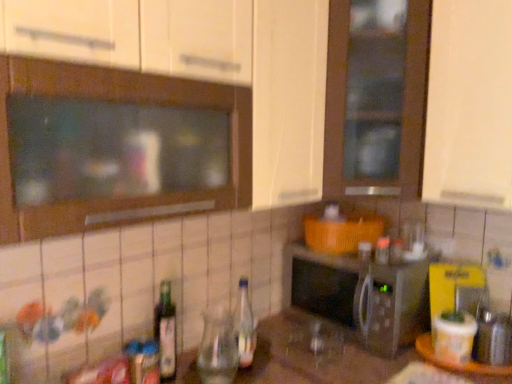
What is the approximate width of clear glass bottle at center, placed as the 1th bottle when sorted from right to left?

It is 2.91 inches.

The height and width of the screenshot is (384, 512). In order to click on green glass bottle at lower left, which is the second bottle from right to left in this screenshot , I will do `click(166, 332)`.

From the image's perspective, would you say wooden tray at lower right is shown under silver metallic microwave at center?

Correct, wooden tray at lower right appears lower than silver metallic microwave at center in the image.

Is wooden tray at lower right not near silver metallic microwave at center?

No, wooden tray at lower right is in close proximity to silver metallic microwave at center.

From a real-world perspective, is wooden tray at lower right located beneath silver metallic microwave at center?

Yes, from a real-world perspective, wooden tray at lower right is beneath silver metallic microwave at center.

How far apart are clear glass bottle at center, the 2th bottle viewed from the left, and green glass bottle at lower left, which is the second bottle from right to left?

A distance of 10.51 inches exists between clear glass bottle at center, the 2th bottle viewed from the left, and green glass bottle at lower left, which is the second bottle from right to left.

Is clear glass bottle at center, the 2th bottle viewed from the left, behind green glass bottle at lower left, arranged as the 1th bottle when viewed from the left?

Yes, clear glass bottle at center, the 2th bottle viewed from the left, is further from the viewer.

Where is `bottle that appears above the green glass bottle at lower left, arranged as the 1th bottle when viewed from the left (from a real-world perspective)`? bottle that appears above the green glass bottle at lower left, arranged as the 1th bottle when viewed from the left (from a real-world perspective) is located at coordinates (244, 326).

Could you tell me if green glass bottle at lower left, arranged as the 1th bottle when viewed from the left, is facing silver metallic microwave at center?

No, green glass bottle at lower left, arranged as the 1th bottle when viewed from the left, is not aimed at silver metallic microwave at center.

Consider the image. Could you measure the distance between green glass bottle at lower left, arranged as the 1th bottle when viewed from the left, and silver metallic microwave at center?

The distance of green glass bottle at lower left, arranged as the 1th bottle when viewed from the left, from silver metallic microwave at center is 26.71 inches.

Which object is wider, green glass bottle at lower left, arranged as the 1th bottle when viewed from the left, or silver metallic microwave at center?

silver metallic microwave at center is wider.

From a real-world perspective, is green glass bottle at lower left, which is the second bottle from right to left, on top of silver metallic microwave at center?

Yes, from a real-world perspective, green glass bottle at lower left, which is the second bottle from right to left, is over silver metallic microwave at center

Which is behind, point (415, 285) or point (425, 355)?

The point (415, 285) is more distant.

Looking at this image, can you confirm if silver metallic microwave at center is shorter than wooden tray at lower right?

No, silver metallic microwave at center is not shorter than wooden tray at lower right.

Is silver metallic microwave at center facing away from wooden tray at lower right?

silver metallic microwave at center does not have its back to wooden tray at lower right.

Is clear glass bottle at center, placed as the 1th bottle when sorted from right to left, wider than wooden tray at lower right?

No, clear glass bottle at center, placed as the 1th bottle when sorted from right to left, is not wider than wooden tray at lower right.

Can you confirm if clear glass bottle at center, the 2th bottle viewed from the left, is taller than wooden tray at lower right?

Yes, clear glass bottle at center, the 2th bottle viewed from the left, is taller than wooden tray at lower right.

From a real-world perspective, is clear glass bottle at center, the 2th bottle viewed from the left, below wooden tray at lower right?

No, from a real-world perspective, clear glass bottle at center, the 2th bottle viewed from the left, is not beneath wooden tray at lower right.

Which is behind, clear glass bottle at center, placed as the 1th bottle when sorted from right to left, or wooden tray at lower right?

wooden tray at lower right.

Which of these two, wooden tray at lower right or green glass bottle at lower left, which is the second bottle from right to left, is bigger?

Bigger between the two is wooden tray at lower right.

How distant is wooden tray at lower right from green glass bottle at lower left, which is the second bottle from right to left?

84.88 centimeters.

Is wooden tray at lower right next to green glass bottle at lower left, which is the second bottle from right to left, and touching it?

No, wooden tray at lower right is not touching green glass bottle at lower left, which is the second bottle from right to left.

Measure the distance between silver metallic microwave at center and clear glass bottle at center, placed as the 1th bottle when sorted from right to left.

silver metallic microwave at center is 14.98 inches from clear glass bottle at center, placed as the 1th bottle when sorted from right to left.

From a real-world perspective, is silver metallic microwave at center over clear glass bottle at center, the 2th bottle viewed from the left?

Actually, silver metallic microwave at center is physically below clear glass bottle at center, the 2th bottle viewed from the left, in the real world.

Which object is positioned more to the left, silver metallic microwave at center or clear glass bottle at center, placed as the 1th bottle when sorted from right to left?

clear glass bottle at center, placed as the 1th bottle when sorted from right to left.

Locate an element on the screen. Image resolution: width=512 pixels, height=384 pixels. microwave oven on the right of clear glass bottle at center, placed as the 1th bottle when sorted from right to left is located at coordinates (362, 296).

In the image, there is a wooden tray at lower right. At what (x,y) coordinates should I click in order to perform the action: click on microwave oven above it (from the image's perspective). Please return your answer as a coordinate pair (x, y). Looking at the image, I should click on (362, 296).

Where is `bottle that appears above the green glass bottle at lower left, arranged as the 1th bottle when viewed from the left (from a real-world perspective)`? bottle that appears above the green glass bottle at lower left, arranged as the 1th bottle when viewed from the left (from a real-world perspective) is located at coordinates (244, 326).

From the picture: Considering their positions, is wooden tray at lower right positioned further to silver metallic microwave at center than clear glass bottle at center, the 2th bottle viewed from the left?

The object further to silver metallic microwave at center is clear glass bottle at center, the 2th bottle viewed from the left.

Looking at the image, which one is located closer to green glass bottle at lower left, which is the second bottle from right to left, clear glass bottle at center, placed as the 1th bottle when sorted from right to left, or wooden tray at lower right?

Among the two, clear glass bottle at center, placed as the 1th bottle when sorted from right to left, is located nearer to green glass bottle at lower left, which is the second bottle from right to left.

Considering their positions, is silver metallic microwave at center positioned further to green glass bottle at lower left, arranged as the 1th bottle when viewed from the left, than clear glass bottle at center, the 2th bottle viewed from the left?

Based on the image, silver metallic microwave at center appears to be further to green glass bottle at lower left, arranged as the 1th bottle when viewed from the left.

Based on their spatial positions, is green glass bottle at lower left, which is the second bottle from right to left, or wooden tray at lower right further from clear glass bottle at center, placed as the 1th bottle when sorted from right to left?

wooden tray at lower right lies further to clear glass bottle at center, placed as the 1th bottle when sorted from right to left, than the other object.

Based on their spatial positions, is green glass bottle at lower left, arranged as the 1th bottle when viewed from the left, or clear glass bottle at center, the 2th bottle viewed from the left, further from silver metallic microwave at center?

Among the two, green glass bottle at lower left, arranged as the 1th bottle when viewed from the left, is located further to silver metallic microwave at center.

Estimate the real-world distances between objects in this image. Which object is further from silver metallic microwave at center, clear glass bottle at center, placed as the 1th bottle when sorted from right to left, or green glass bottle at lower left, arranged as the 1th bottle when viewed from the left?

green glass bottle at lower left, arranged as the 1th bottle when viewed from the left, is positioned further to the anchor silver metallic microwave at center.

When comparing their distances from green glass bottle at lower left, arranged as the 1th bottle when viewed from the left, does silver metallic microwave at center or wooden tray at lower right seem closer?

silver metallic microwave at center is positioned closer to the anchor green glass bottle at lower left, arranged as the 1th bottle when viewed from the left.

Considering their positions, is wooden tray at lower right positioned closer to silver metallic microwave at center than green glass bottle at lower left, which is the second bottle from right to left?

wooden tray at lower right is closer to silver metallic microwave at center.

You are a GUI agent. You are given a task and a screenshot of the screen. Output one action in this format:
    pyautogui.click(x=<x>, y=<y>)
    Task: Click on the bottle located between green glass bottle at lower left, which is the second bottle from right to left, and wooden tray at lower right in the left-right direction
    This screenshot has height=384, width=512.
    Given the screenshot: What is the action you would take?
    pyautogui.click(x=244, y=326)

Locate an element on the screen. This screenshot has height=384, width=512. bottle situated between green glass bottle at lower left, which is the second bottle from right to left, and silver metallic microwave at center from left to right is located at coordinates (244, 326).

Identify the location of microwave oven situated between green glass bottle at lower left, which is the second bottle from right to left, and wooden tray at lower right from left to right. The width and height of the screenshot is (512, 384). (362, 296).

Locate an element on the screen. This screenshot has height=384, width=512. microwave oven situated between clear glass bottle at center, the 2th bottle viewed from the left, and wooden tray at lower right from left to right is located at coordinates (362, 296).